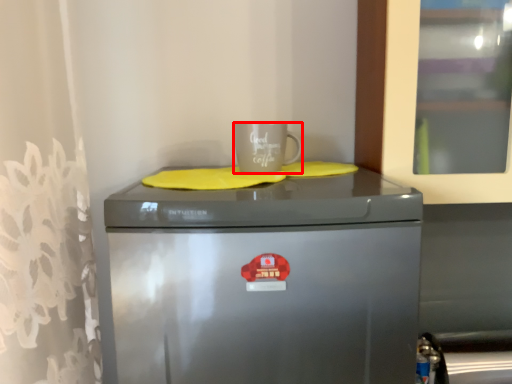
Question: From the image's perspective, where is mug (annotated by the red box) located relative to home appliance?

Choices:
 (A) below
 (B) above

Answer: (B)